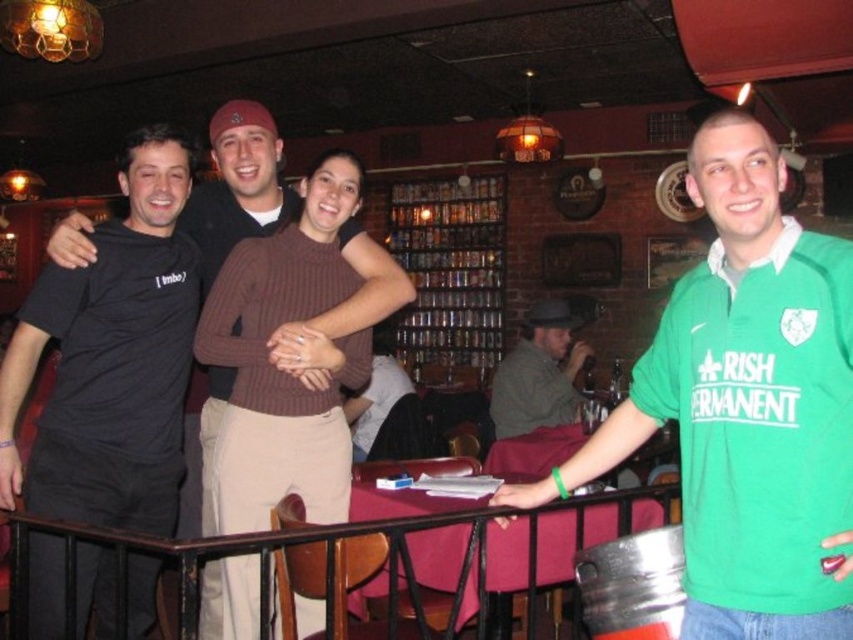
You are standing at the entrance of the bar and want to approach the black metal rail at center. Based on its 2D coordinates, in which direction should you walk to reach it?

The black metal rail at center is located at coordinates point (276, 548), so you should walk towards the center of the bar to reach it.